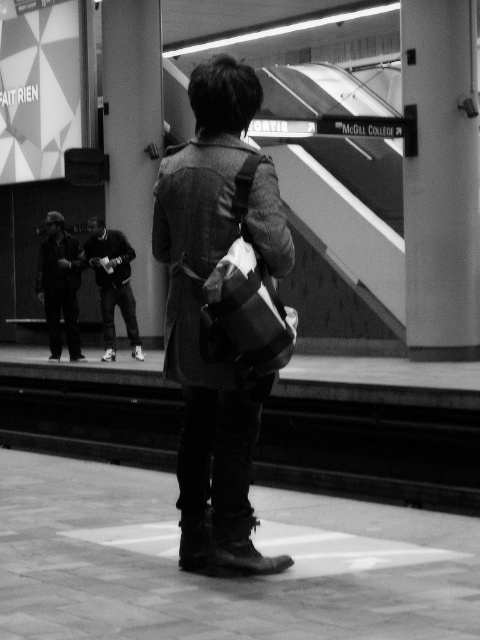
Is smooth concrete pillar at upper left closer to the viewer compared to dark gray sweater at center?

No, smooth concrete pillar at upper left is further to the viewer.

How far apart are smooth concrete pillar at upper left and dark gray sweater at center?

The distance of smooth concrete pillar at upper left from dark gray sweater at center is 5.55 meters.

Measure the distance between smooth concrete pillar at upper left and camera.

smooth concrete pillar at upper left and camera are 59.01 feet apart from each other.

I want to click on smooth concrete pillar at upper left, so click(133, 141).

Where is `denim jacket at center`? The image size is (480, 640). denim jacket at center is located at coordinates (202, 307).

Based on the photo, can you confirm if denim jacket at center is positioned to the left of dark fabric jacket at lower left?

No, denim jacket at center is not to the left of dark fabric jacket at lower left.

Is point (212, 486) positioned after point (55, 321)?

No, it is in front of (55, 321).

Image resolution: width=480 pixels, height=640 pixels. Find the location of `denim jacket at center`. denim jacket at center is located at coordinates (202, 307).

Can you confirm if denim jacket at center is smaller than dark gray sweater at center?

Correct, denim jacket at center occupies less space than dark gray sweater at center.

Can you confirm if denim jacket at center is wider than dark gray sweater at center?

No, denim jacket at center is not wider than dark gray sweater at center.

Is point (230, 508) farther from viewer compared to point (99, 241)?

No, (230, 508) is in front of (99, 241).

The width and height of the screenshot is (480, 640). I want to click on denim jacket at center, so click(x=202, y=307).